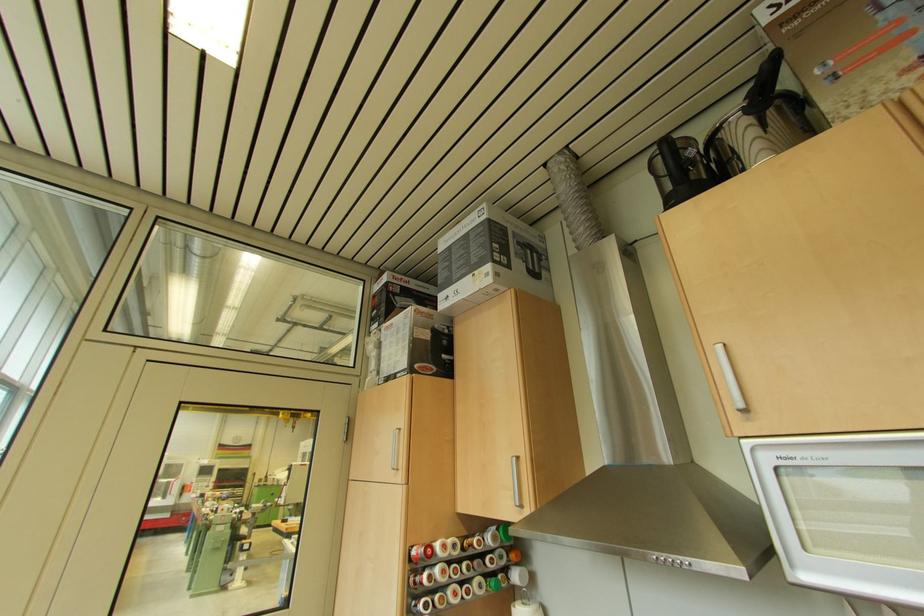
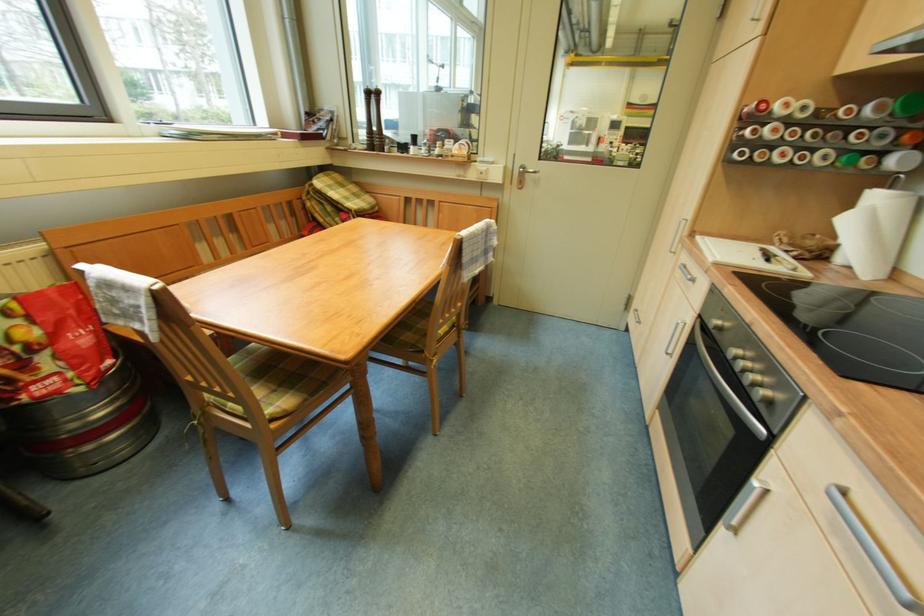
In the scene shown: Based on the continuous images, in which direction is the camera rotating?

The camera's rotation is toward left-down.